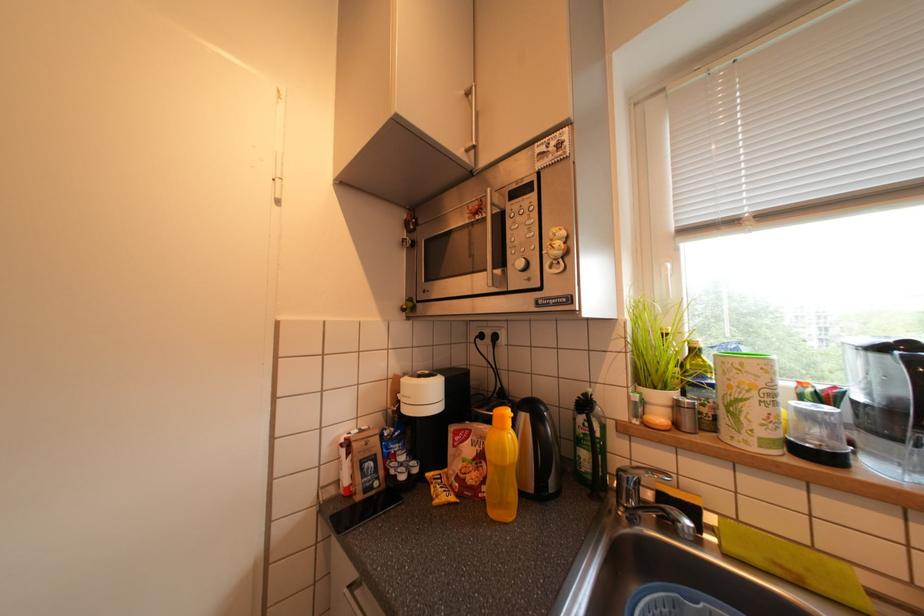
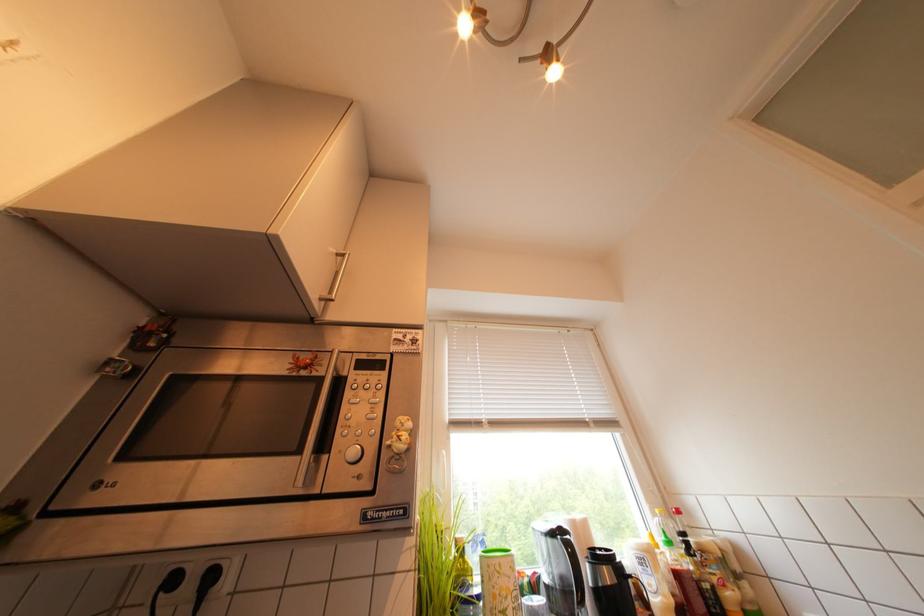
First-person continuous shooting, in which direction is the camera rotating?

The camera's rotation is toward right-up.